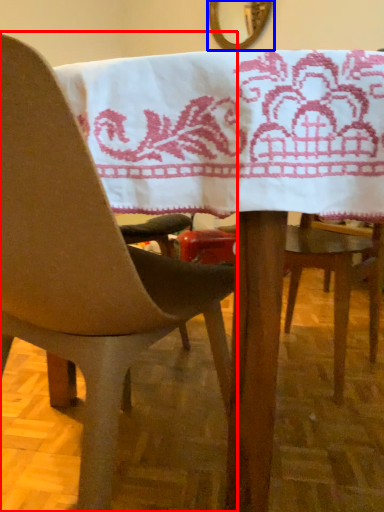
Question: Which of the following is the farthest to the observer, chair (highlighted by a red box) or mirror (highlighted by a blue box)?

Choices:
 (A) chair
 (B) mirror

Answer: (B)